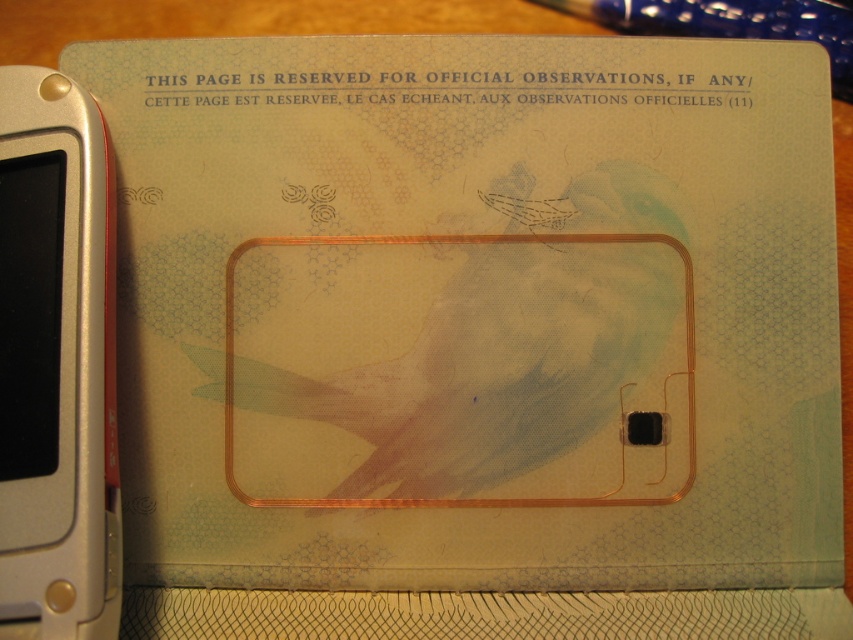
Can you confirm if silver metallic smartphone at left is positioned to the right of transparent plastic pen at upper center?

In fact, silver metallic smartphone at left is to the left of transparent plastic pen at upper center.

Who is more distant from viewer, (6, 508) or (624, 22)?

Positioned behind is point (624, 22).

Which is in front, point (53, 412) or point (624, 12)?

Point (53, 412)

Where is `silver metallic smartphone at left`? Image resolution: width=853 pixels, height=640 pixels. silver metallic smartphone at left is located at coordinates (56, 362).